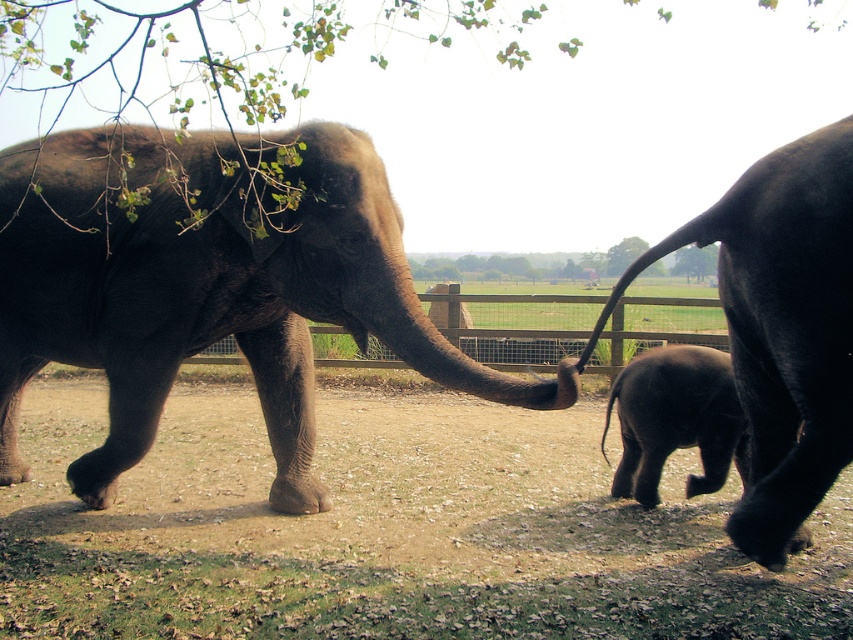
Question: Does brown sandy dirt at center come in front of green leafy tree at upper center?

Choices:
 (A) no
 (B) yes

Answer: (B)

Question: Among these objects, which one is nearest to the camera?

Choices:
 (A) green leafy tree at upper center
 (B) dark gray wrinkled elephant at right
 (C) dark brown wrinkled elephant at left
 (D) brown sandy dirt at center

Answer: (B)

Question: Considering the real-world distances, which object is farthest from the dark brown wrinkled elephant at left?

Choices:
 (A) dark brown wrinkled skin baby elephant at center
 (B) green leafy tree at upper center
 (C) brown sandy dirt at center
 (D) dark gray wrinkled elephant at right

Answer: (B)

Question: Can you confirm if brown sandy dirt at center is thinner than dark brown wrinkled skin baby elephant at center?

Choices:
 (A) yes
 (B) no

Answer: (B)

Question: Is dark brown wrinkled skin baby elephant at center to the left of green leafy tree at upper center from the viewer's perspective?

Choices:
 (A) yes
 (B) no

Answer: (A)

Question: Which object is positioned farthest from the green leafy tree at upper center?

Choices:
 (A) dark brown wrinkled elephant at left
 (B) brown sandy dirt at center
 (C) dark brown wrinkled skin baby elephant at center
 (D) dark gray wrinkled elephant at right

Answer: (D)